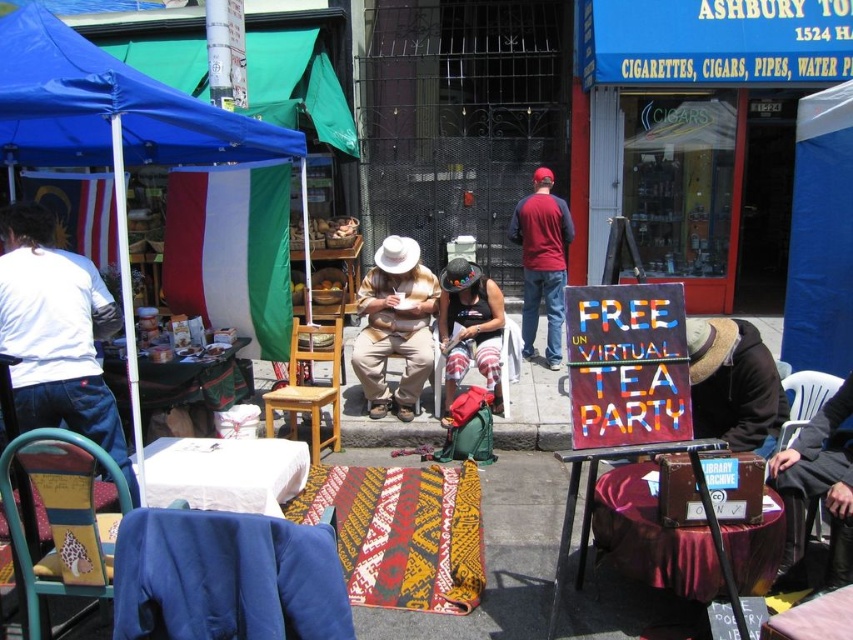
Question: Does brown straw hat at lower right appear over white plastic chair at lower right?

Choices:
 (A) no
 (B) yes

Answer: (B)

Question: Which object is the farthest from the brown straw hat at lower right?

Choices:
 (A) blue fabric canopy at upper left
 (B) maroon cotton shirt at center
 (C) white fabric table at lower left

Answer: (A)

Question: Does white cotton shirt at left appear on the left side of brown straw hat at lower right?

Choices:
 (A) yes
 (B) no

Answer: (A)

Question: Which point is closer to the camera?

Choices:
 (A) (294, 353)
 (B) (265, 477)
 (C) (74, 268)
 (D) (80, 468)

Answer: (D)

Question: Which point is closer to the camera?

Choices:
 (A) (45, 140)
 (B) (4, 490)
 (C) (140, 515)
 (D) (233, 486)

Answer: (C)

Question: Is blue fabric chair at lower left smaller than multicolored fabric chair at lower left?

Choices:
 (A) yes
 (B) no

Answer: (A)